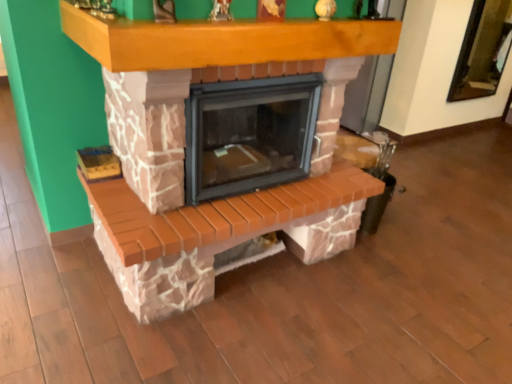
Image resolution: width=512 pixels, height=384 pixels. Describe the element at coordinates (223, 41) in the screenshot. I see `wooden mantle at upper center` at that location.

Measure the distance between point (62, 25) and camera.

They are 5.68 feet apart.

At what (x,y) coordinates should I click in order to perform the action: click on wooden mantle at upper center. Please return your answer as a coordinate pair (x, y). The image size is (512, 384). Looking at the image, I should click on (223, 41).

In order to face brick fireplace at center, should I rotate leftwards or rightwards?

To face it directly, rotate left by 3.659 degrees.

Describe the element at coordinates (149, 132) in the screenshot. The width and height of the screenshot is (512, 384). I see `brick fireplace at center` at that location.

Image resolution: width=512 pixels, height=384 pixels. In order to click on brick fireplace at center in this screenshot , I will do `click(149, 132)`.

Find the location of a particular element. wooden mantle at upper center is located at coordinates (223, 41).

Is brick fireplace at center at the right side of wooden mantle at upper center?

No, brick fireplace at center is not to the right of wooden mantle at upper center.

Is brick fireplace at center behind wooden mantle at upper center?

Yes, it is behind wooden mantle at upper center.

Between point (172, 92) and point (351, 36), which one is positioned behind?

The point (351, 36) is more distant.

From the image's perspective, is brick fireplace at center on wooden mantle at upper center?

Actually, brick fireplace at center appears below wooden mantle at upper center in the image.

From a real-world perspective, is brick fireplace at center under wooden mantle at upper center?

Indeed, from a real-world perspective, brick fireplace at center is positioned beneath wooden mantle at upper center.

Considering the relative sizes of brick fireplace at center and wooden mantle at upper center in the image provided, is brick fireplace at center wider than wooden mantle at upper center?

In fact, brick fireplace at center might be narrower than wooden mantle at upper center.

Is brick fireplace at center taller than wooden mantle at upper center?

Yes.

Which of these two, brick fireplace at center or wooden mantle at upper center, is bigger?

brick fireplace at center is bigger.

Is brick fireplace at center not within wooden mantle at upper center?

Yes, brick fireplace at center is not within wooden mantle at upper center.

Is brick fireplace at center placed right next to wooden mantle at upper center?

There is a gap between brick fireplace at center and wooden mantle at upper center.

Is brick fireplace at center oriented towards wooden mantle at upper center?

No, brick fireplace at center does not turn towards wooden mantle at upper center.

What's the angular difference between brick fireplace at center and wooden mantle at upper center's facing directions?

The angular difference between brick fireplace at center and wooden mantle at upper center is 0.000841 degrees.

Locate an element on the screen. The height and width of the screenshot is (384, 512). fireplace lying on the left of wooden mantle at upper center is located at coordinates [149, 132].

Which object is positioned more to the right, wooden mantle at upper center or brick fireplace at center?

From the viewer's perspective, wooden mantle at upper center appears more on the right side.

Considering the positions of objects wooden mantle at upper center and brick fireplace at center in the image provided, who is in front, wooden mantle at upper center or brick fireplace at center?

wooden mantle at upper center.

Which is in front, point (112, 54) or point (125, 86)?

The point (112, 54) is more forward.

From the image's perspective, does wooden mantle at upper center appear higher than brick fireplace at center?

Indeed, from the image's perspective, wooden mantle at upper center is shown above brick fireplace at center.

From a real-world perspective, which object stands above the other?

wooden mantle at upper center.

Is wooden mantle at upper center wider or thinner than brick fireplace at center?

Considering their sizes, wooden mantle at upper center looks broader than brick fireplace at center.

Is wooden mantle at upper center shorter than brick fireplace at center?

Yes, wooden mantle at upper center is shorter than brick fireplace at center.

Between wooden mantle at upper center and brick fireplace at center, which one has larger size?

Bigger between the two is brick fireplace at center.

Is wooden mantle at upper center not within brick fireplace at center?

That's correct, wooden mantle at upper center is outside of brick fireplace at center.

Is wooden mantle at upper center positioned far away from brick fireplace at center?

Actually, wooden mantle at upper center and brick fireplace at center are a little close together.

Is wooden mantle at upper center facing towards brick fireplace at center?

No, wooden mantle at upper center is not facing towards brick fireplace at center.

How different are the orientations of wooden mantle at upper center and brick fireplace at center in degrees?

The angular difference between wooden mantle at upper center and brick fireplace at center is 0.000841 degrees.

How far apart are wooden mantle at upper center and brick fireplace at center?

A distance of 9.76 inches exists between wooden mantle at upper center and brick fireplace at center.

Locate an element on the screen. The width and height of the screenshot is (512, 384). fireplace located underneath the wooden mantle at upper center (from a real-world perspective) is located at coordinates (149, 132).

Find the location of `mantle on the right of brick fireplace at center`. mantle on the right of brick fireplace at center is located at coordinates (223, 41).

Locate an element on the screen. Image resolution: width=512 pixels, height=384 pixels. fireplace below the wooden mantle at upper center (from a real-world perspective) is located at coordinates (149, 132).